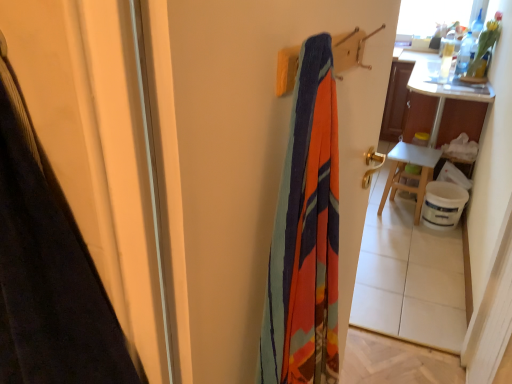
In order to click on white wooden table at right in this screenshot , I will do `click(410, 174)`.

Where is `textured fabric screen door at center`? The height and width of the screenshot is (384, 512). textured fabric screen door at center is located at coordinates (251, 161).

From the image's perspective, is white wooden table at right above or below white wooden table at right?

white wooden table at right is above white wooden table at right.

Considering the sizes of objects white wooden table at right and white wooden table at right in the image provided, who is taller, white wooden table at right or white wooden table at right?

With more height is white wooden table at right.

Is white wooden table at right looking in the opposite direction of white wooden table at right?

white wooden table at right is not turned away from white wooden table at right.

Considering the relative sizes of white wooden table at right and textured fabric screen door at center in the image provided, is white wooden table at right wider than textured fabric screen door at center?

Yes, white wooden table at right is wider than textured fabric screen door at center.

From the picture: From a real-world perspective, which is physically below, white wooden table at right or textured fabric screen door at center?

From a 3D spatial view, white wooden table at right is below.

Between white wooden table at right and textured fabric screen door at center, which one has larger size?

With larger size is textured fabric screen door at center.

Could you tell me if white wooden table at right is facing textured fabric screen door at center?

Yes, white wooden table at right faces towards textured fabric screen door at center.

How many degrees apart are the facing directions of textured fabric screen door at center and white wooden table at right?

169 degrees.

From the image's perspective, between textured fabric screen door at center and white wooden table at right, which one is located above?

white wooden table at right.

Consider the image. Which is farther from the camera, (374, 127) or (433, 67)?

The point (433, 67) is behind.

In the scene shown: Is textured fabric screen door at center bigger than white wooden table at right?

Indeed, textured fabric screen door at center has a larger size compared to white wooden table at right.

Is textured fabric screen door at center to the right of white wooden table at right from the viewer's perspective?

Incorrect, textured fabric screen door at center is not on the right side of white wooden table at right.

Could you tell me if textured fabric screen door at center is turned towards white wooden table at right?

No, textured fabric screen door at center is not turned towards white wooden table at right.

From a real-world perspective, who is located higher, textured fabric screen door at center or white wooden table at right?

textured fabric screen door at center.

Is white wooden table at right not close to textured fabric screen door at center?

Yes, white wooden table at right and textured fabric screen door at center are quite far apart.

Does white wooden table at right have a greater height compared to textured fabric screen door at center?

No.

Who is more distant, white wooden table at right or textured fabric screen door at center?

white wooden table at right is further from the camera.

From the image's perspective, is white wooden table at right on white wooden table at right?

No, from the image's perspective, white wooden table at right is not on top of white wooden table at right.

From the picture: Which object is closer to the camera, white wooden table at right or white wooden table at right?

white wooden table at right is more forward.

Does white wooden table at right touch white wooden table at right?

Yes, white wooden table at right is in contact with white wooden table at right.

Which object is positioned more to the right, white wooden table at right or white wooden table at right?

white wooden table at right.

At what (x,y) coordinates should I click in order to perform the action: click on furniture that appears below the white wooden table at right (from the image's perspective). Please return your answer as a coordinate pair (x, y). This screenshot has height=384, width=512. Looking at the image, I should click on (410, 174).

Identify the location of furniture that is on the right side of textured fabric screen door at center. The width and height of the screenshot is (512, 384). (410, 174).

Based on their spatial positions, is textured fabric screen door at center or white wooden table at right further from white wooden table at right?

textured fabric screen door at center is positioned further to the anchor white wooden table at right.

Based on the photo, estimate the real-world distances between objects in this image. Which object is closer to white wooden table at right, textured fabric screen door at center or white wooden table at right?

white wooden table at right is closer to white wooden table at right.

When comparing their distances from textured fabric screen door at center, does white wooden table at right or white wooden table at right seem further?

Among the two, white wooden table at right is located further to textured fabric screen door at center.

Based on the photo, when comparing their distances from white wooden table at right, does white wooden table at right or textured fabric screen door at center seem further?

textured fabric screen door at center is further to white wooden table at right.

Considering their positions, is white wooden table at right positioned closer to white wooden table at right than textured fabric screen door at center?

The object closer to white wooden table at right is white wooden table at right.

Looking at the image, which one is located closer to textured fabric screen door at center, white wooden table at right or white wooden table at right?

Based on the image, white wooden table at right appears to be nearer to textured fabric screen door at center.

Image resolution: width=512 pixels, height=384 pixels. Identify the location of table located between textured fabric screen door at center and white wooden table at right in the depth direction. (428, 128).